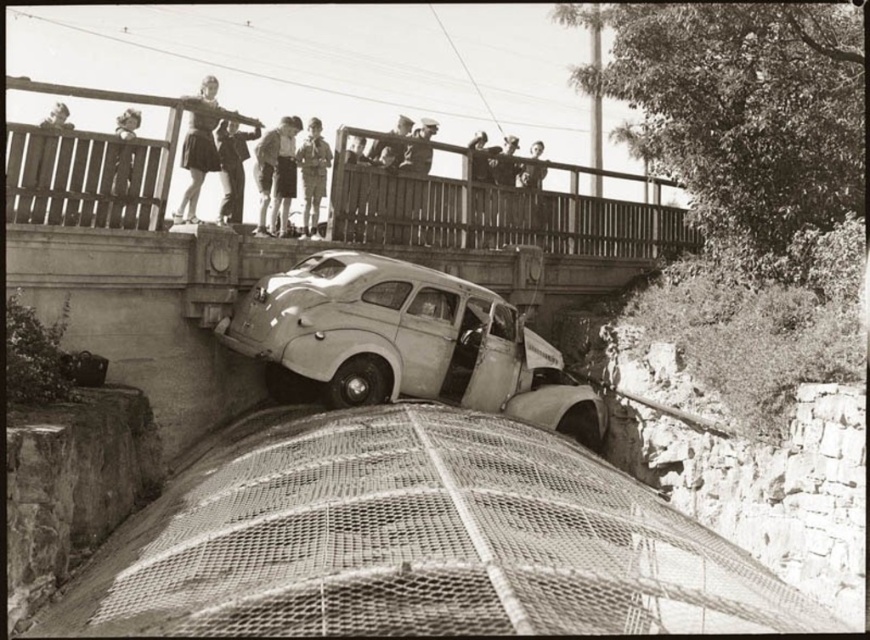
You are a safety inspector at the accident site. You need to place a 2 meter long caution tape between the light brown uniform at center and the light brown uniform at upper center. Is the distance sufficient for the tape to stretch between them without cutting it?

The distance between the light brown uniform at center and the light brown uniform at upper center is 1.83 meters. Since the caution tape is 2 meters long, it is longer than the required distance. Therefore, the tape can be stretched between them without needing to cut it, leaving some extra length.

You are a pedestrian standing near the accident scene. You see a light brown shorts at upper center and a light brown uniform at center. Which one is closer to you?

The light brown shorts at upper center is closer to you because it is in front of the light brown uniform at center.